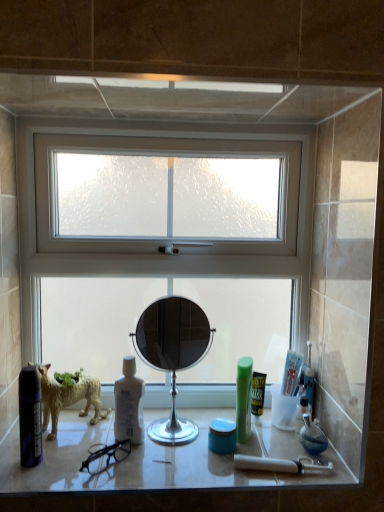
You are a GUI agent. You are given a task and a screenshot of the screen. Output one action in this format:
    pyautogui.click(x=<x>, y=<y>)
    Task: Click on the vacant region above white glossy countertop at center (from a real-world perspective)
    This screenshot has width=384, height=512.
    Given the screenshot: What is the action you would take?
    pyautogui.click(x=158, y=443)